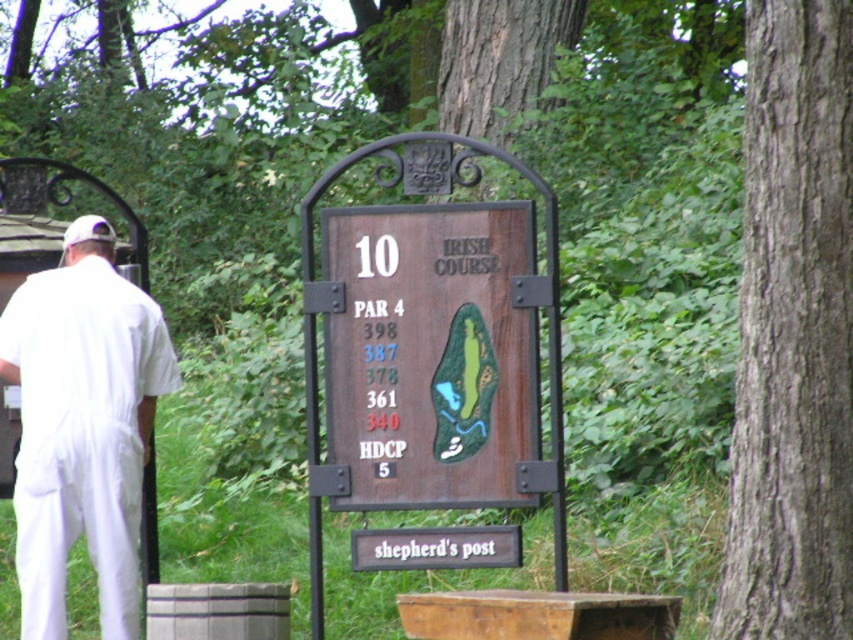
Question: Is brown rough bark tree at right positioned before white fabric baseball cap at upper left?

Choices:
 (A) no
 (B) yes

Answer: (B)

Question: Is wooden sign at center smaller than white fabric baseball cap at upper left?

Choices:
 (A) yes
 (B) no

Answer: (A)

Question: Can you confirm if brown rough bark tree at right is positioned above white fabric baseball cap at upper left?

Choices:
 (A) yes
 (B) no

Answer: (B)

Question: Based on their relative distances, which object is farther from the white cotton shirt at left?

Choices:
 (A) wooden sign at center
 (B) white fabric baseball cap at upper left

Answer: (A)

Question: Which object appears farthest from the camera in this image?

Choices:
 (A) brown rough bark tree at right
 (B) white cotton shirt at left
 (C) wooden sign at center

Answer: (B)

Question: Which point appears farthest from the camera in this image?

Choices:
 (A) (64, 243)
 (B) (453, 493)
 (C) (143, 392)

Answer: (A)